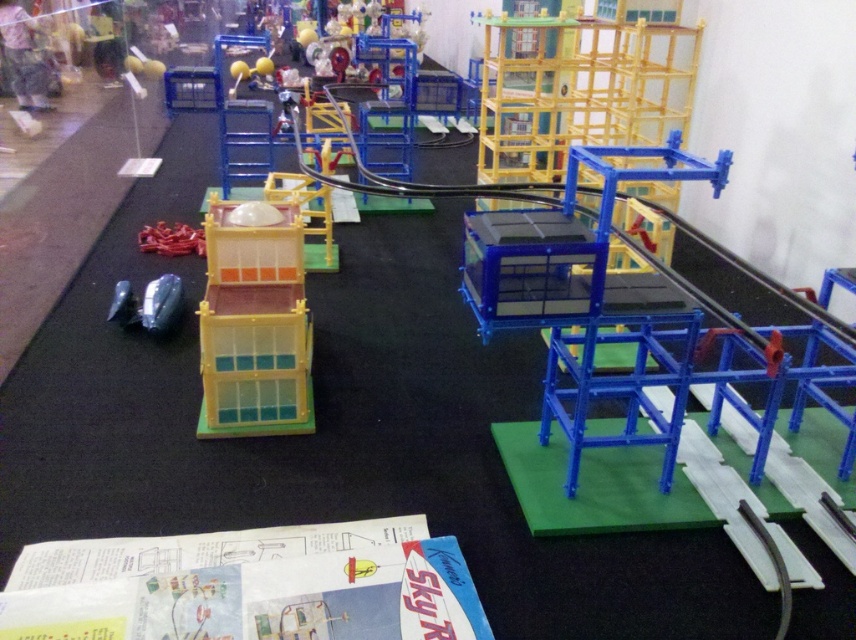
Question: Which object is closer to the camera taking this photo?

Choices:
 (A) translucent yellow plastic tower at center-left
 (B) glossy plastic toy car at lower left

Answer: (A)

Question: Can you confirm if translucent yellow plastic tower at center-left is bigger than glossy plastic toy car at lower left?

Choices:
 (A) yes
 (B) no

Answer: (A)

Question: Does translucent yellow plastic tower at center-left have a smaller size compared to glossy plastic toy car at lower left?

Choices:
 (A) yes
 (B) no

Answer: (B)

Question: Does translucent yellow plastic tower at center-left have a larger size compared to glossy plastic toy car at lower left?

Choices:
 (A) no
 (B) yes

Answer: (B)

Question: Which of the following is the closest to the observer?

Choices:
 (A) glossy plastic toy car at lower left
 (B) translucent yellow plastic tower at center-left

Answer: (B)